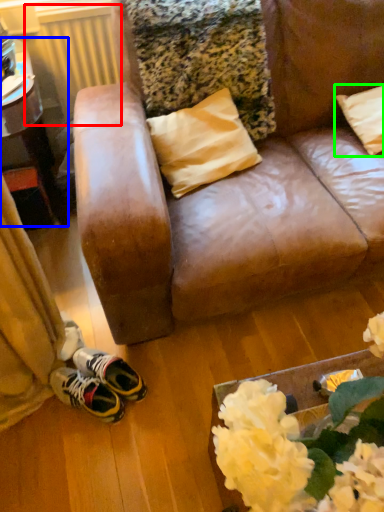
Question: Based on their relative distances, which object is farther from radiator (highlighted by a red box)? Choose from table (highlighted by a blue box) and pillow (highlighted by a green box).

Choices:
 (A) table
 (B) pillow

Answer: (B)